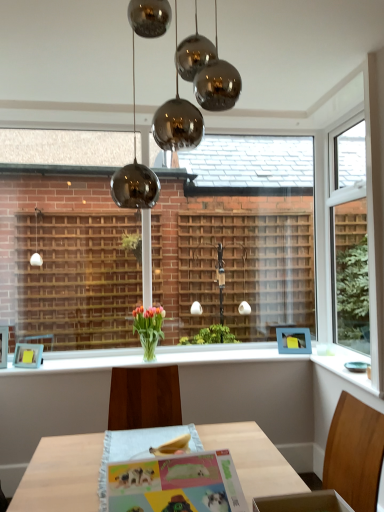
Find the location of a particular element. This screenshot has height=512, width=384. unoccupied region to the right of translucent glass vase at center is located at coordinates (190, 355).